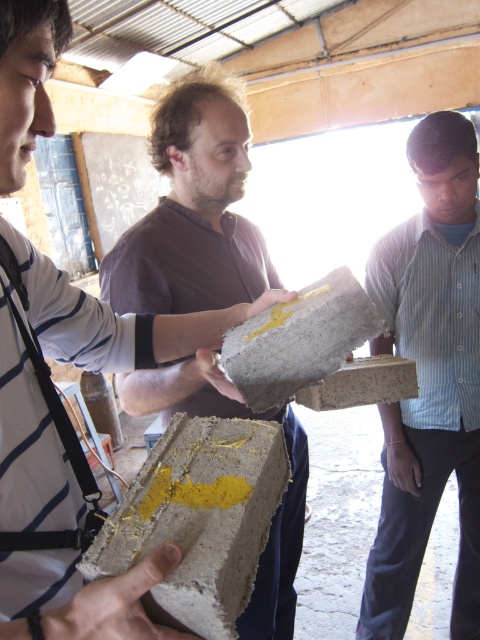
Question: Does blue striped shirt at right appear on the right side of concrete block with yellow paint at center?

Choices:
 (A) no
 (B) yes

Answer: (B)

Question: Among these objects, which one is nearest to the camera?

Choices:
 (A) concrete block with yellow paint at center
 (B) blue striped shirt at right

Answer: (A)

Question: Which of the following is the closest to the observer?

Choices:
 (A) blue striped shirt at right
 (B) concrete block with yellow paint at center
 (C) concrete block at center

Answer: (B)

Question: Does matte concrete block at center have a greater width compared to concrete block with yellow paint at center?

Choices:
 (A) no
 (B) yes

Answer: (B)

Question: Does blue striped shirt at right appear on the left side of matte concrete block at center?

Choices:
 (A) yes
 (B) no

Answer: (B)

Question: Which object is farther from the camera taking this photo?

Choices:
 (A) blue striped shirt at right
 (B) concrete block at center
 (C) matte concrete block at center
 (D) concrete block with yellow paint at center

Answer: (A)